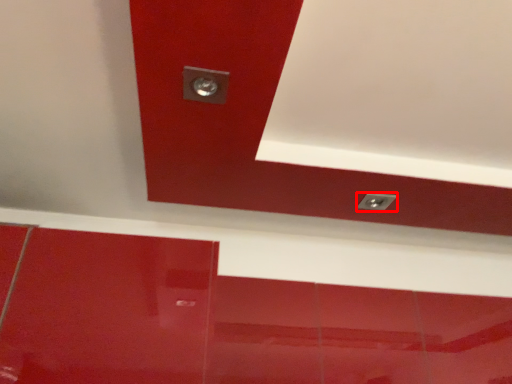
Question: From the image, what is the correct spatial relationship of knob (annotated by the red box) in relation to exhaust hood?

Choices:
 (A) right
 (B) left

Answer: (A)